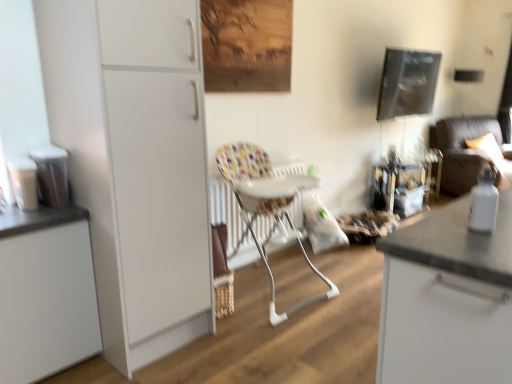
Question: From the image's perspective, is metallic reflective picture frame at upper right located beneath printed fabric highchair at center?

Choices:
 (A) no
 (B) yes

Answer: (A)

Question: Does metallic reflective picture frame at upper right have a larger size compared to printed fabric highchair at center?

Choices:
 (A) no
 (B) yes

Answer: (A)

Question: Is metallic reflective picture frame at upper right with printed fabric highchair at center?

Choices:
 (A) yes
 (B) no

Answer: (B)

Question: Considering the relative sizes of metallic reflective picture frame at upper right and printed fabric highchair at center in the image provided, is metallic reflective picture frame at upper right wider than printed fabric highchair at center?

Choices:
 (A) no
 (B) yes

Answer: (A)

Question: Is metallic reflective picture frame at upper right shorter than printed fabric highchair at center?

Choices:
 (A) no
 (B) yes

Answer: (B)

Question: Looking at the image, does printed fabric highchair at center seem bigger or smaller compared to white matte cabinet at left, the 1th cabinetry when ordered from right to left?

Choices:
 (A) big
 (B) small

Answer: (B)

Question: Considering the relative positions of printed fabric highchair at center and white matte cabinet at left, arranged as the 2th cabinetry when viewed from the left, in the image provided, is printed fabric highchair at center to the left or to the right of white matte cabinet at left, arranged as the 2th cabinetry when viewed from the left,?

Choices:
 (A) left
 (B) right

Answer: (B)

Question: From a real-world perspective, is printed fabric highchair at center above or below white matte cabinet at left, arranged as the 2th cabinetry when viewed from the left?

Choices:
 (A) above
 (B) below

Answer: (B)

Question: From the image's perspective, is printed fabric highchair at center above or below white matte cabinet at left, arranged as the 2th cabinetry when viewed from the left?

Choices:
 (A) below
 (B) above

Answer: (A)

Question: Is white glossy bottle at right situated inside satin silver trash can at left, the 2th appliance from the left, or outside?

Choices:
 (A) inside
 (B) outside

Answer: (B)

Question: In terms of size, does white glossy bottle at right appear bigger or smaller than satin silver trash can at left, the 2th appliance from the left?

Choices:
 (A) small
 (B) big

Answer: (A)

Question: From the image's perspective, is white glossy bottle at right located above or below satin silver trash can at left, the 2th appliance from the left?

Choices:
 (A) above
 (B) below

Answer: (B)

Question: In the image, is white glossy bottle at right on the left side or the right side of satin silver trash can at left, the 2th appliance from the left?

Choices:
 (A) left
 (B) right

Answer: (B)

Question: Is white glossy bottle at right inside or outside of matte plastic containers at left, arranged as the 1th appliance when viewed from the left?

Choices:
 (A) outside
 (B) inside

Answer: (A)

Question: Considering the positions of white glossy bottle at right and matte plastic containers at left, arranged as the 2th appliance when viewed from the right, in the image, is white glossy bottle at right taller or shorter than matte plastic containers at left, arranged as the 2th appliance when viewed from the right,?

Choices:
 (A) short
 (B) tall

Answer: (A)